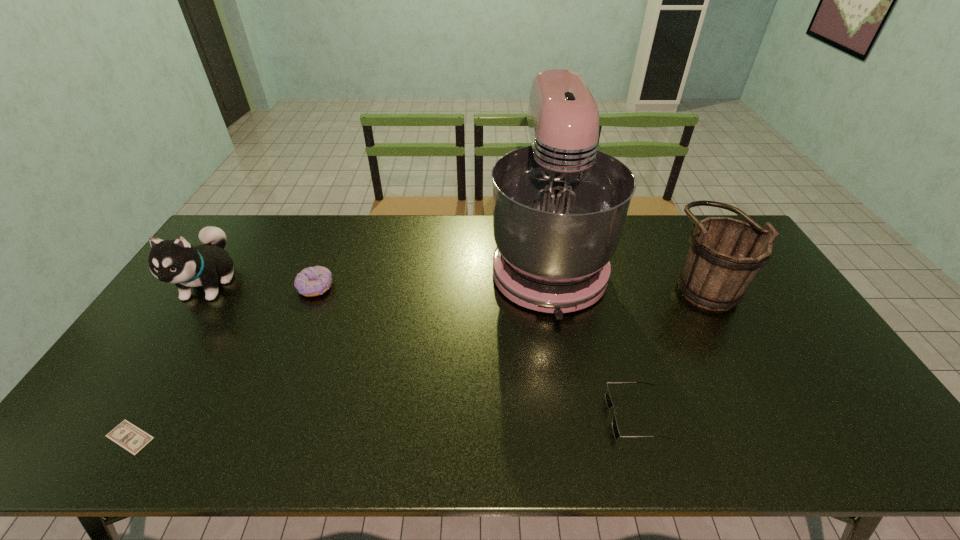
This screenshot has width=960, height=540. I want to click on free spot between the second shortest object and the mixer, so click(x=591, y=340).

Select which object appears as the fourth closest to the third object from left to right. Please provide its 2D coordinates. Your answer should be formatted as a tuple, i.e. [(x, y)], where the tuple contains the x and y coordinates of a point satisfying the conditions above.

[(609, 403)]

This screenshot has width=960, height=540. In order to click on object that is the third closest to the money in this screenshot , I will do `click(559, 206)`.

Locate an element on the screen. The width and height of the screenshot is (960, 540). vacant space that satisfies the following two spatial constraints: 1. at the face of the doughnut; 2. on the left side of the puppy is located at coordinates (206, 287).